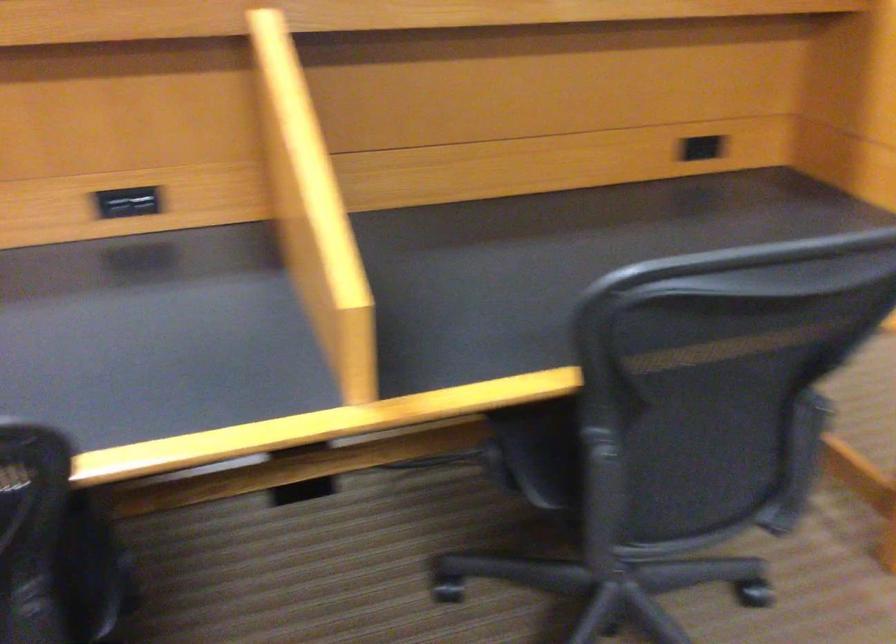
What do you see at coordinates (805, 450) in the screenshot?
I see `the chair armrest` at bounding box center [805, 450].